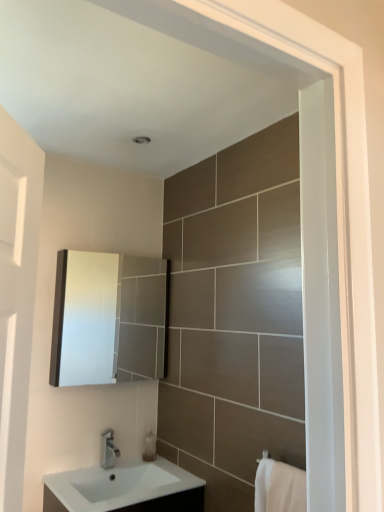
Question: In terms of height, does translucent plastic soap dispenser at lower center look taller or shorter compared to white glossy sink at lower center, arranged as the first sink when viewed from the top?

Choices:
 (A) tall
 (B) short

Answer: (B)

Question: Is translucent plastic soap dispenser at lower center situated inside white glossy sink at lower center, arranged as the first sink when viewed from the top, or outside?

Choices:
 (A) inside
 (B) outside

Answer: (B)

Question: Which object is the farthest from the translucent plastic soap dispenser at lower center?

Choices:
 (A) silver metallic tap at lower center
 (B) white cotton bath towel at lower right
 (C) matte white cabinet at upper left
 (D) white glossy sink at lower center, the 1th sink from the bottom
 (E) white glossy sink at lower center, arranged as the first sink when viewed from the top

Answer: (C)

Question: Estimate the real-world distances between objects in this image. Which object is closer to the white glossy sink at lower center, which appears as the 2th sink when ordered from the bottom?

Choices:
 (A) white glossy sink at lower center, the 1th sink from the bottom
 (B) silver metallic tap at lower center
 (C) white cotton bath towel at lower right
 (D) matte white cabinet at upper left
 (E) translucent plastic soap dispenser at lower center

Answer: (A)